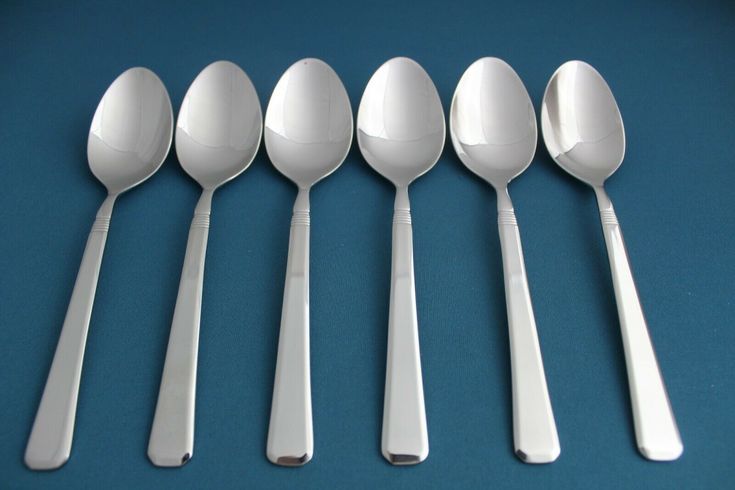
Find the location of `handles`. handles is located at coordinates point(90,262), point(184,281), point(293,270), point(404,271), point(514,278), point(625,283).